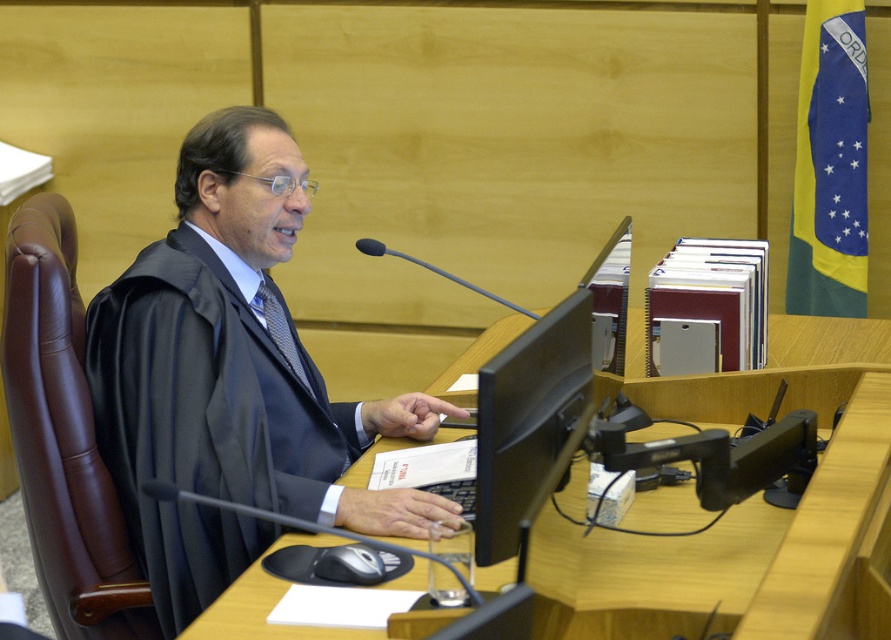
Does wooden desk at center appear over black textured tie at center?

Actually, wooden desk at center is below black textured tie at center.

Image resolution: width=891 pixels, height=640 pixels. Describe the element at coordinates (740, 508) in the screenshot. I see `wooden desk at center` at that location.

This screenshot has height=640, width=891. I want to click on wooden desk at center, so click(x=740, y=508).

Which is more to the left, black matte robe at center or wooden desk at center?

black matte robe at center is more to the left.

Between black matte robe at center and wooden desk at center, which one is positioned higher?

Positioned higher is black matte robe at center.

Where is `black matte robe at center`? This screenshot has height=640, width=891. black matte robe at center is located at coordinates (231, 380).

Can you confirm if black matte robe at center is positioned above black textured tie at center?

Incorrect, black matte robe at center is not positioned above black textured tie at center.

Between point (260, 429) and point (279, 346), which one is positioned behind?

Positioned behind is point (279, 346).

The image size is (891, 640). What do you see at coordinates (231, 380) in the screenshot?
I see `black matte robe at center` at bounding box center [231, 380].

Identify the location of black matte robe at center. (231, 380).